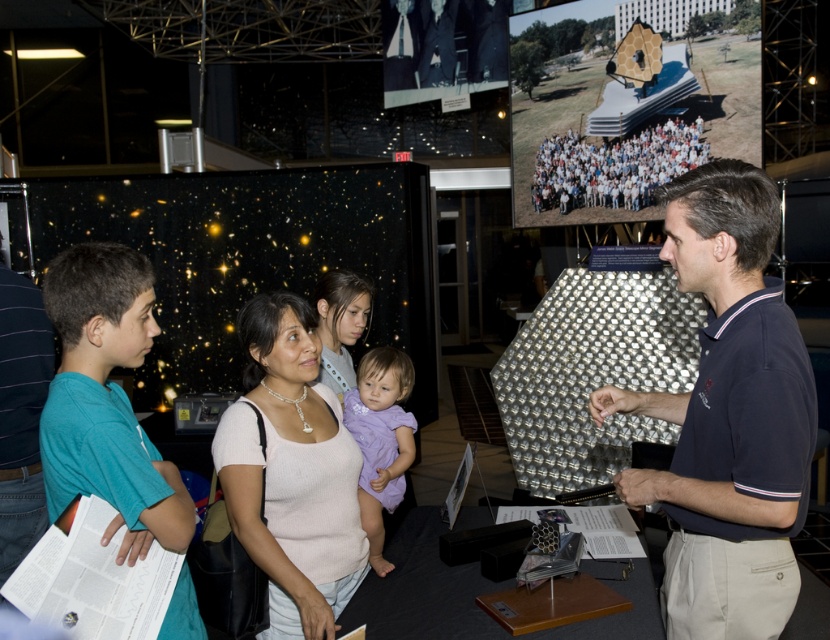
Is dark blue polo shirt at center positioned at the back of striped cotton shirt at left?

No, dark blue polo shirt at center is in front of striped cotton shirt at left.

Does dark blue polo shirt at center appear on the left side of striped cotton shirt at left?

Incorrect, dark blue polo shirt at center is not on the left side of striped cotton shirt at left.

You are a GUI agent. You are given a task and a screenshot of the screen. Output one action in this format:
    pyautogui.click(x=<x>, y=<y>)
    Task: Click on the dark blue polo shirt at center
    Image resolution: width=830 pixels, height=640 pixels.
    Given the screenshot: What is the action you would take?
    pyautogui.click(x=728, y=417)

The height and width of the screenshot is (640, 830). Find the location of `dark blue polo shirt at center`. dark blue polo shirt at center is located at coordinates [x=728, y=417].

Is striped cotton shirt at left to the left of white clothed people at center from the viewer's perspective?

Indeed, striped cotton shirt at left is positioned on the left side of white clothed people at center.

Which is behind, point (40, 294) or point (632, 145)?

Point (632, 145)

Does point (8, 470) come behind point (706, 144)?

No, (8, 470) is closer to viewer.

Locate an element on the screen. striped cotton shirt at left is located at coordinates (22, 413).

Does pink ribbed sweater at center have a larger size compared to white clothed people at center?

Actually, pink ribbed sweater at center might be smaller than white clothed people at center.

Based on the photo, how distant is pink ribbed sweater at center from white clothed people at center?

They are 2.31 meters apart.

Is point (330, 570) closer to viewer compared to point (604, 202)?

Yes, point (330, 570) is closer to viewer.

At what (x,y) coordinates should I click in order to perform the action: click on pink ribbed sweater at center. Please return your answer as a coordinate pair (x, y). This screenshot has height=640, width=830. Looking at the image, I should click on (291, 472).